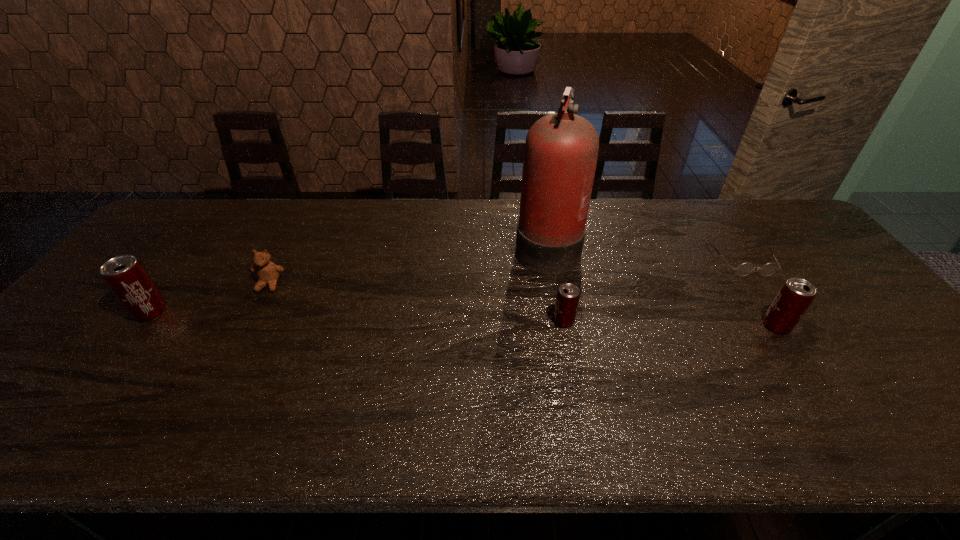
The height and width of the screenshot is (540, 960). Identify the location of the leftmost object. (126, 277).

Find the location of a particular element. The height and width of the screenshot is (540, 960). the second tallest object is located at coordinates (126, 277).

Locate an element on the screen. This screenshot has width=960, height=540. the second beer can from left to right is located at coordinates (568, 295).

Locate an element on the screen. the second shortest beer can is located at coordinates (795, 296).

This screenshot has height=540, width=960. In order to click on the fourth shortest object in this screenshot , I will do `click(795, 296)`.

Where is `the tallest object`? The height and width of the screenshot is (540, 960). the tallest object is located at coordinates (561, 149).

Locate an element on the screen. the shortest object is located at coordinates (744, 269).

Locate an element on the screen. This screenshot has height=540, width=960. teddy bear is located at coordinates (268, 273).

What are the coordinates of `vacant space located on the back of the tallest beer can` in the screenshot? It's located at 218,224.

Locate an element on the screen. This screenshot has width=960, height=540. free location located on the right of the shortest beer can is located at coordinates (702, 321).